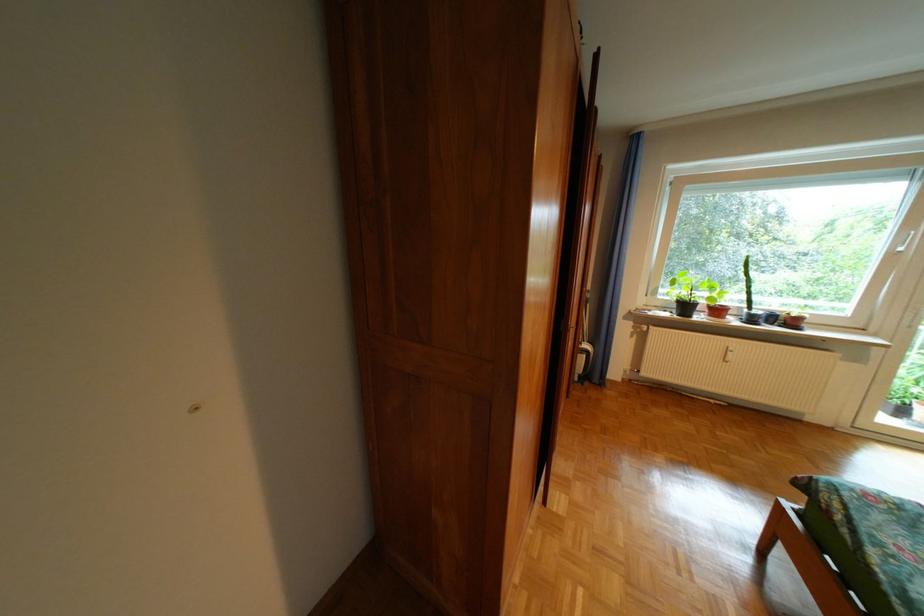
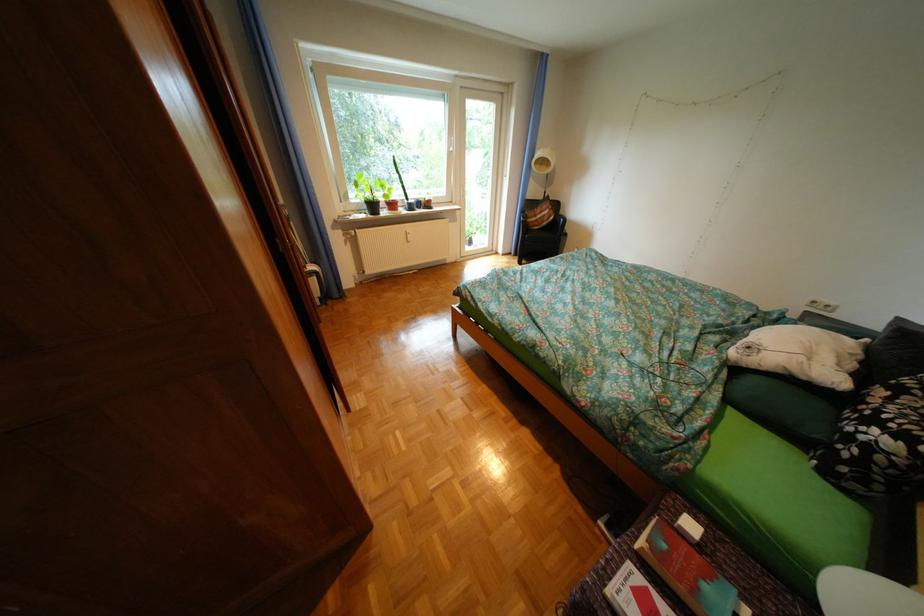
In the second image, find the point that corresponds to (x=675, y=298) in the first image.

(368, 201)